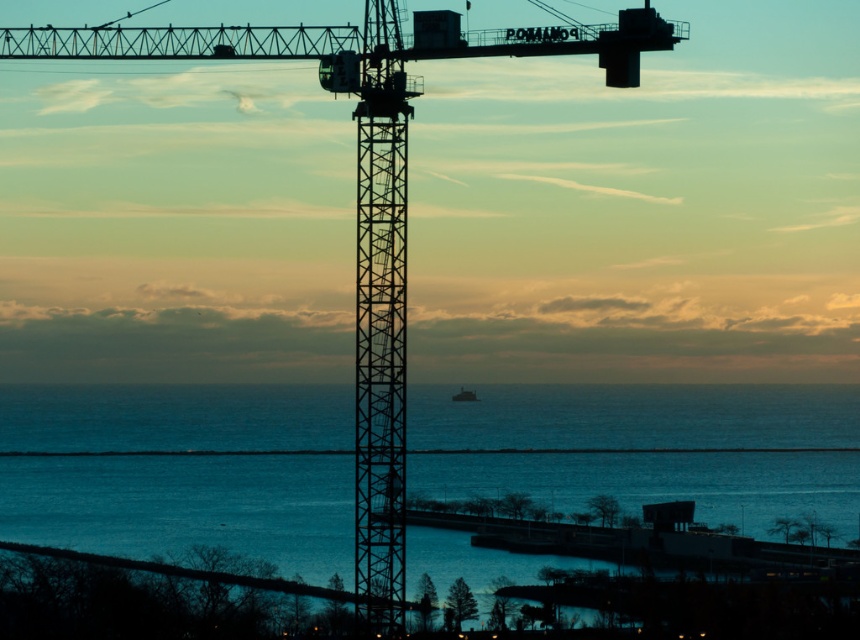
Question: Among these objects, which one is farthest from the camera?

Choices:
 (A) green matte boat at center
 (B) blue water at center

Answer: (B)

Question: Which point is farther to the camera?

Choices:
 (A) (453, 400)
 (B) (112, 429)

Answer: (B)

Question: Is blue water at center thinner than green matte boat at center?

Choices:
 (A) yes
 (B) no

Answer: (B)

Question: Can you confirm if blue water at center is wider than green matte boat at center?

Choices:
 (A) yes
 (B) no

Answer: (A)

Question: Is blue water at center positioned in front of green matte boat at center?

Choices:
 (A) no
 (B) yes

Answer: (A)